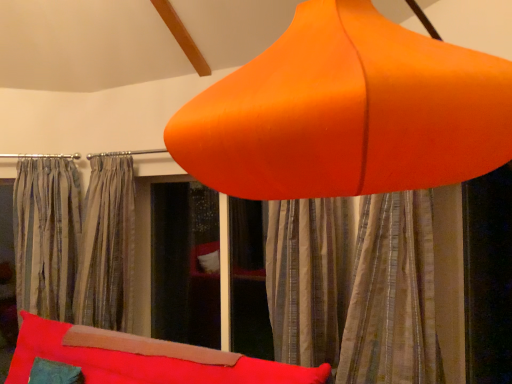
Question: Would you say striped fabric curtain at center, which ranks as the 1th curtain in front-to-back order, is to the left or to the right of velvet red bean bag at lower center in the picture?

Choices:
 (A) left
 (B) right

Answer: (B)

Question: Looking at the image, does striped fabric curtain at center, which ranks as the 1th curtain in front-to-back order, seem bigger or smaller compared to velvet red bean bag at lower center?

Choices:
 (A) small
 (B) big

Answer: (A)

Question: Based on their relative distances, which object is nearer to the silky gray curtains at center, placed as the 1th curtain when sorted from back to front?

Choices:
 (A) orange matte lampshade at upper center
 (B) striped fabric curtain at center, marked as the 2th curtain in a back-to-front arrangement
 (C) velvet red bean bag at lower center

Answer: (C)

Question: Which of these objects is positioned closest to the orange matte lampshade at upper center?

Choices:
 (A) striped fabric curtain at center, the second curtain viewed from the left
 (B) velvet red bean bag at lower center
 (C) silky gray curtains at center, the second curtain when ordered from right to left

Answer: (A)